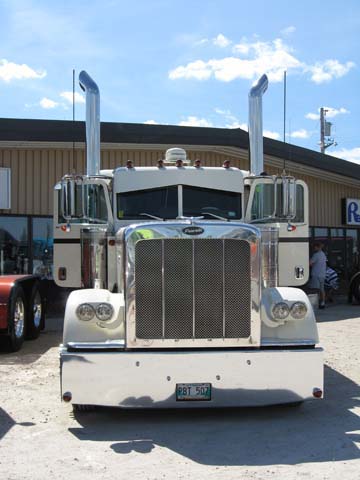
You are a GUI agent. You are given a task and a screenshot of the screen. Output one action in this format:
    pyautogui.click(x=<x>, y=<y>)
    Task: Click on the mirrors
    
    Given the screenshot: What is the action you would take?
    pyautogui.click(x=287, y=192), pyautogui.click(x=68, y=196)